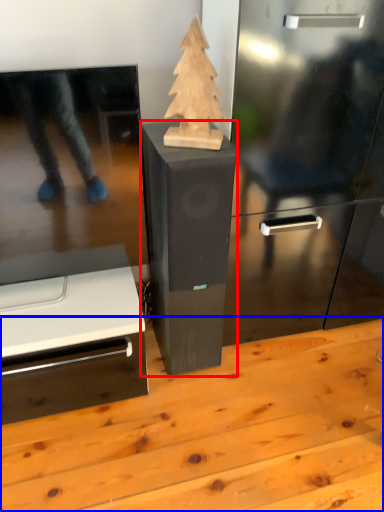
Question: Which of the following is the farthest to the observer, furniture (highlighted by a red box) or table (highlighted by a blue box)?

Choices:
 (A) furniture
 (B) table

Answer: (A)